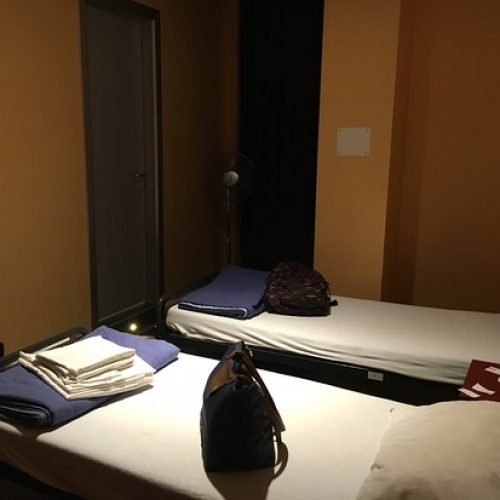
The height and width of the screenshot is (500, 500). In order to click on twin bed in this screenshot , I will do `click(349, 418)`, `click(391, 345)`.